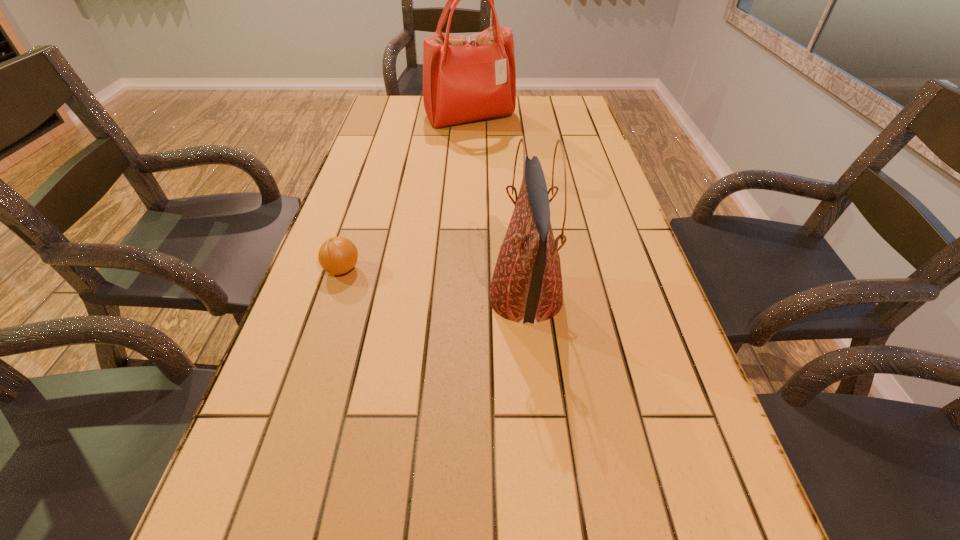
Image resolution: width=960 pixels, height=540 pixels. What are the coordinates of `the farther handbag` in the screenshot? It's located at (465, 79).

Where is `the farthest object`? The height and width of the screenshot is (540, 960). the farthest object is located at coordinates (465, 79).

This screenshot has width=960, height=540. Find the location of `the second tallest object`. the second tallest object is located at coordinates point(526,286).

Locate an element on the screen. the shorter handbag is located at coordinates (526, 286).

At what (x,y) coordinates should I click in order to perform the action: click on orange. Please return your answer as a coordinate pair (x, y). This screenshot has width=960, height=540. Looking at the image, I should click on (338, 255).

You are a GUI agent. You are given a task and a screenshot of the screen. Output one action in this format:
    pyautogui.click(x=<x>, y=<y>)
    Task: Click on the shortest object
    This screenshot has height=540, width=960.
    Given the screenshot: What is the action you would take?
    pyautogui.click(x=338, y=255)

The height and width of the screenshot is (540, 960). Find the location of `vacant space located on the front-facing side of the farthest object`. vacant space located on the front-facing side of the farthest object is located at coordinates (468, 174).

At what (x,y) coordinates should I click in order to perform the action: click on vacant region located 0.280m on the front of the second tallest object. Please return your answer as a coordinate pair (x, y). This screenshot has height=540, width=960. Looking at the image, I should click on pyautogui.click(x=545, y=494).

The height and width of the screenshot is (540, 960). I want to click on vacant region located on the front of the leftmost object, so click(288, 433).

At what (x,y) coordinates should I click in order to perform the action: click on object situated at the far edge. Please return your answer as a coordinate pair (x, y). The width and height of the screenshot is (960, 540). Looking at the image, I should click on (465, 79).